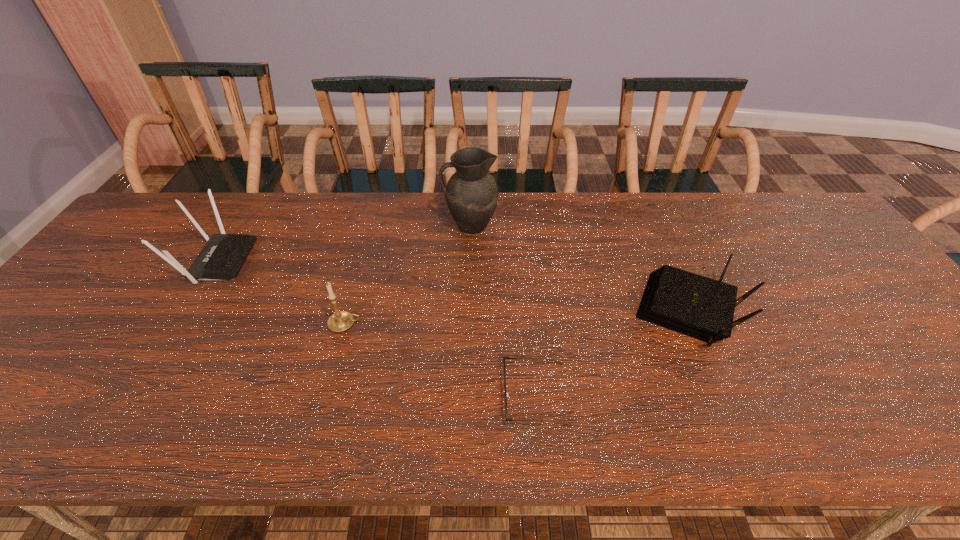
You are a GUI agent. You are given a task and a screenshot of the screen. Output one action in this format:
    pyautogui.click(x=<x>, y=<y>)
    Task: Click on the blank region between the candle holder and the spectacles
    
    Given the screenshot: What is the action you would take?
    [x=441, y=359]

Locate an element on the screen. This screenshot has width=960, height=540. free space that is in between the fourth object from right to left and the taller router is located at coordinates pyautogui.click(x=281, y=293).

Identify the location of unoccupied position between the fourth tallest object and the shortest object. (612, 353).

Locate an element on the screen. The image size is (960, 540). free spot between the nearest object and the fourth object from right to left is located at coordinates (441, 359).

Identify which object is located as the third nearest to the rightmost object. Please provide its 2D coordinates. Your answer should be formatted as a tuple, i.e. [(x, y)], where the tuple contains the x and y coordinates of a point satisfying the conditions above.

[(340, 321)]

Identify which object is the second closest to the fourth tallest object. Please provide its 2D coordinates. Your answer should be formatted as a tuple, i.e. [(x, y)], where the tuple contains the x and y coordinates of a point satisfying the conditions above.

[(471, 193)]

I want to click on vacant area that satisfies the following two spatial constraints: 1. on the back side of the right router; 2. on the front-facing side of the left router, so click(x=666, y=261).